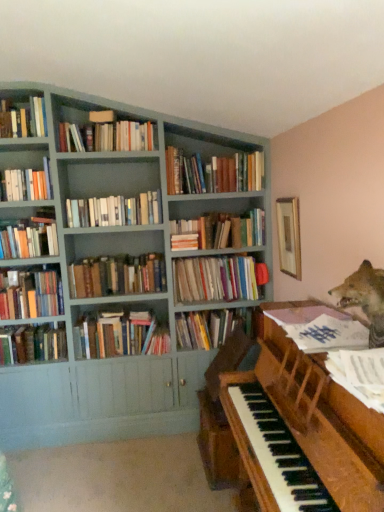
Question: Is the depth of matte gray bookcase at upper left less than that of hardcover books at center, which is counted as the 8th book, starting from the bottom?

Choices:
 (A) yes
 (B) no

Answer: (A)

Question: Can you confirm if matte gray bookcase at upper left is shorter than hardcover books at center, marked as the 8th book in a top-to-bottom arrangement?

Choices:
 (A) yes
 (B) no

Answer: (B)

Question: Is matte gray bookcase at upper left bigger than hardcover books at center, marked as the 8th book in a top-to-bottom arrangement?

Choices:
 (A) yes
 (B) no

Answer: (A)

Question: From the image's perspective, is matte gray bookcase at upper left above hardcover books at center, which is counted as the 8th book, starting from the bottom?

Choices:
 (A) no
 (B) yes

Answer: (B)

Question: Is matte gray bookcase at upper left positioned far away from hardcover books at center, which is counted as the 8th book, starting from the bottom?

Choices:
 (A) yes
 (B) no

Answer: (B)

Question: Considering the relative positions of matte gray bookcase at upper left and hardcover books at center, which is counted as the 8th book, starting from the bottom, in the image provided, is matte gray bookcase at upper left to the left of hardcover books at center, which is counted as the 8th book, starting from the bottom, from the viewer's perspective?

Choices:
 (A) yes
 (B) no

Answer: (B)

Question: Does wooden picture frame at upper right have a greater height compared to hardcover books at upper left, placed as the 15th book when sorted from bottom to top?

Choices:
 (A) yes
 (B) no

Answer: (A)

Question: Is wooden picture frame at upper right facing away from hardcover books at upper left, placed as the 15th book when sorted from bottom to top?

Choices:
 (A) yes
 (B) no

Answer: (B)

Question: Is wooden picture frame at upper right located outside hardcover books at upper left, placed as the first book when sorted from top to bottom?

Choices:
 (A) no
 (B) yes

Answer: (B)

Question: Considering the relative sizes of wooden picture frame at upper right and hardcover books at upper left, placed as the first book when sorted from top to bottom, in the image provided, is wooden picture frame at upper right bigger than hardcover books at upper left, placed as the first book when sorted from top to bottom,?

Choices:
 (A) no
 (B) yes

Answer: (A)

Question: Could you tell me if wooden picture frame at upper right is facing hardcover books at upper left, placed as the 15th book when sorted from bottom to top?

Choices:
 (A) yes
 (B) no

Answer: (A)

Question: Is wooden picture frame at upper right shorter than hardcover books at upper left, placed as the first book when sorted from top to bottom?

Choices:
 (A) yes
 (B) no

Answer: (B)

Question: Is hardcover books at left, arranged as the 9th book when ordered from the bottom, touching hardcover books at left, arranged as the tenth book when viewed from the top?

Choices:
 (A) no
 (B) yes

Answer: (A)